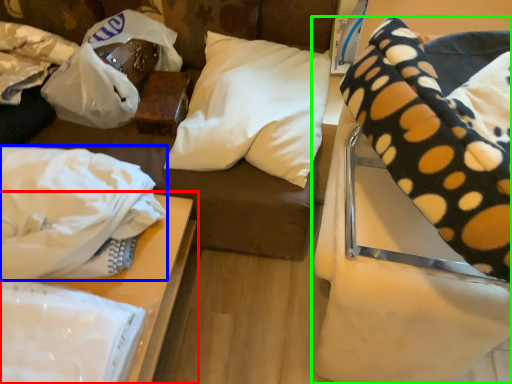
Question: Which is farther away from table (highlighted by a red box)? material (highlighted by a blue box) or furniture (highlighted by a green box)?

Choices:
 (A) material
 (B) furniture

Answer: (B)